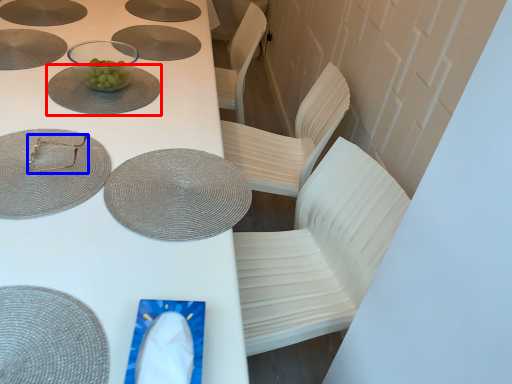
Question: Which of the following is the closest to the observer, glass plate (highlighted by a red box) or tableware (highlighted by a blue box)?

Choices:
 (A) glass plate
 (B) tableware

Answer: (B)